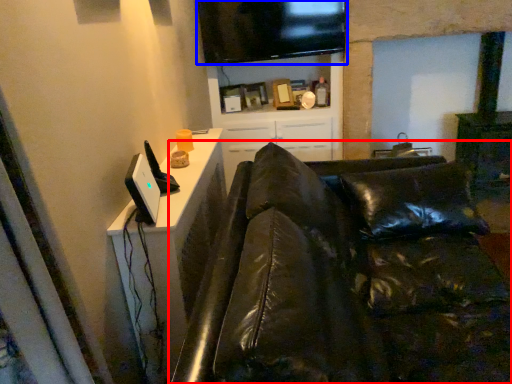
Question: Which of the following is the closest to the observer, studio couch (highlighted by a red box) or television (highlighted by a blue box)?

Choices:
 (A) studio couch
 (B) television

Answer: (A)